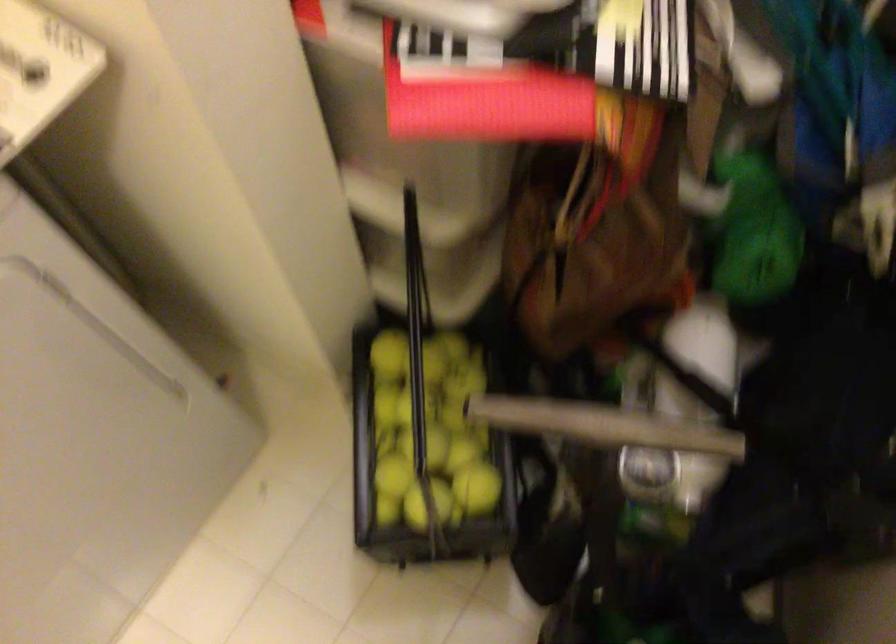
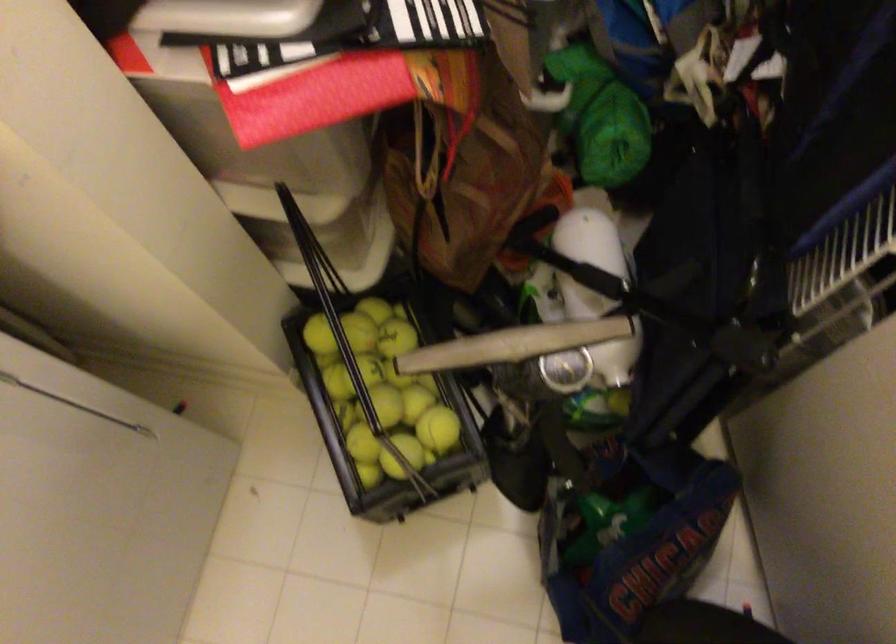
Question: How did the camera likely rotate?

Choices:
 (A) Left
 (B) Right
 (C) Up
 (D) Down

Answer: (D)